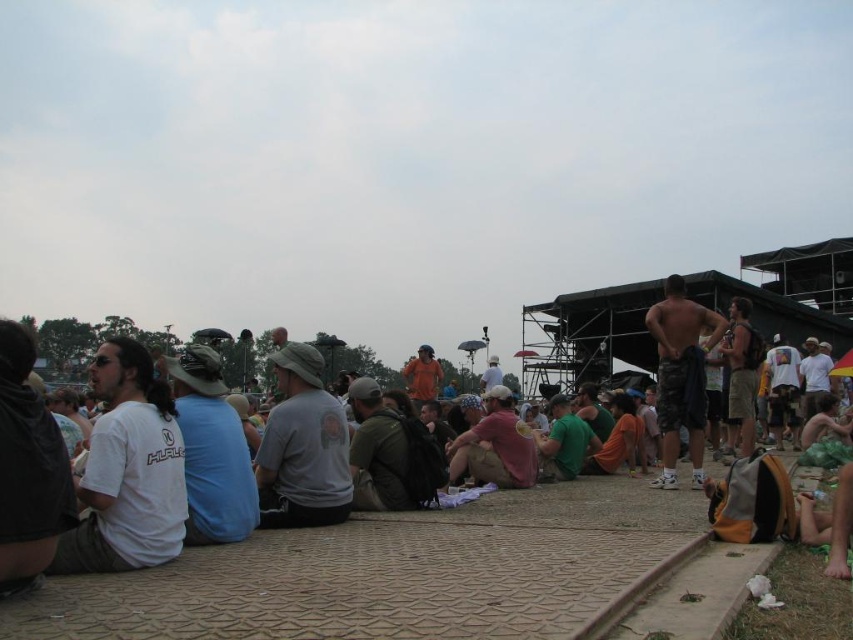
In the scene shown: Is gray matte t-shirt at center bigger than pink fabric shirt at center?

Actually, gray matte t-shirt at center might be smaller than pink fabric shirt at center.

Who is positioned more to the left, gray matte t-shirt at center or pink fabric shirt at center?

From the viewer's perspective, gray matte t-shirt at center appears more on the left side.

This screenshot has width=853, height=640. Describe the element at coordinates (302, 448) in the screenshot. I see `gray matte t-shirt at center` at that location.

Locate an element on the screen. The image size is (853, 640). gray matte t-shirt at center is located at coordinates (302, 448).

Does gray matte t-shirt at center have a greater height compared to camouflage shorts at center?

In fact, gray matte t-shirt at center may be shorter than camouflage shorts at center.

Which is below, gray matte t-shirt at center or camouflage shorts at center?

gray matte t-shirt at center

Which is behind, point (341, 416) or point (672, 339)?

Point (672, 339)

Where is `gray matte t-shirt at center`? The image size is (853, 640). gray matte t-shirt at center is located at coordinates point(302,448).

Describe the element at coordinates (682, 376) in the screenshot. The height and width of the screenshot is (640, 853). I see `camouflage shorts at center` at that location.

Who is shorter, camouflage shorts at center or pink fabric shirt at center?

With less height is pink fabric shirt at center.

Which is behind, point (682, 339) or point (508, 432)?

Positioned behind is point (508, 432).

Locate an element on the screen. Image resolution: width=853 pixels, height=640 pixels. camouflage shorts at center is located at coordinates (682, 376).